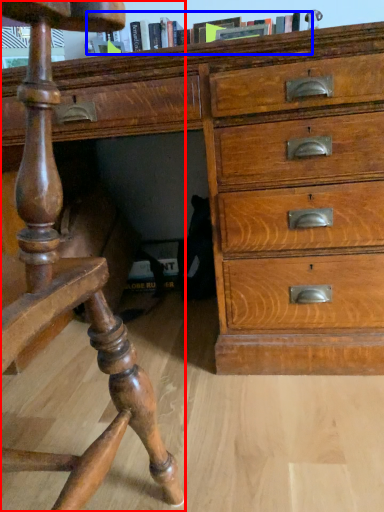
Question: Which object appears closest to the camera in this image, furniture (highlighted by a red box) or book (highlighted by a blue box)?

Choices:
 (A) furniture
 (B) book

Answer: (A)